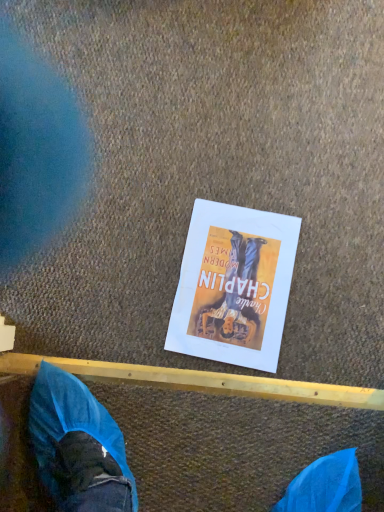
Where is `white paper poster at center`? This screenshot has height=512, width=384. white paper poster at center is located at coordinates (234, 285).

What do you see at coordinates (234, 285) in the screenshot? I see `white paper poster at center` at bounding box center [234, 285].

The width and height of the screenshot is (384, 512). In order to click on white paper poster at center in this screenshot , I will do `click(234, 285)`.